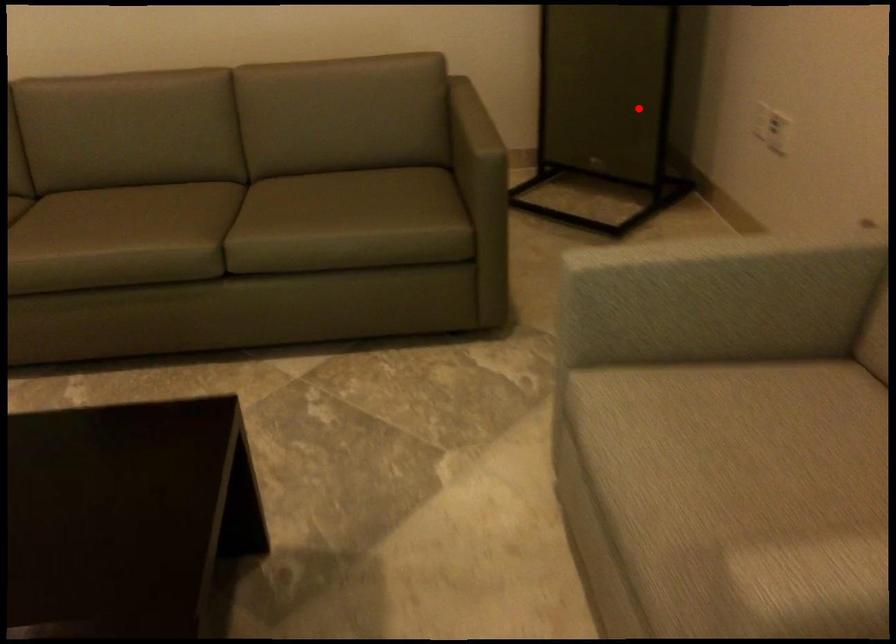
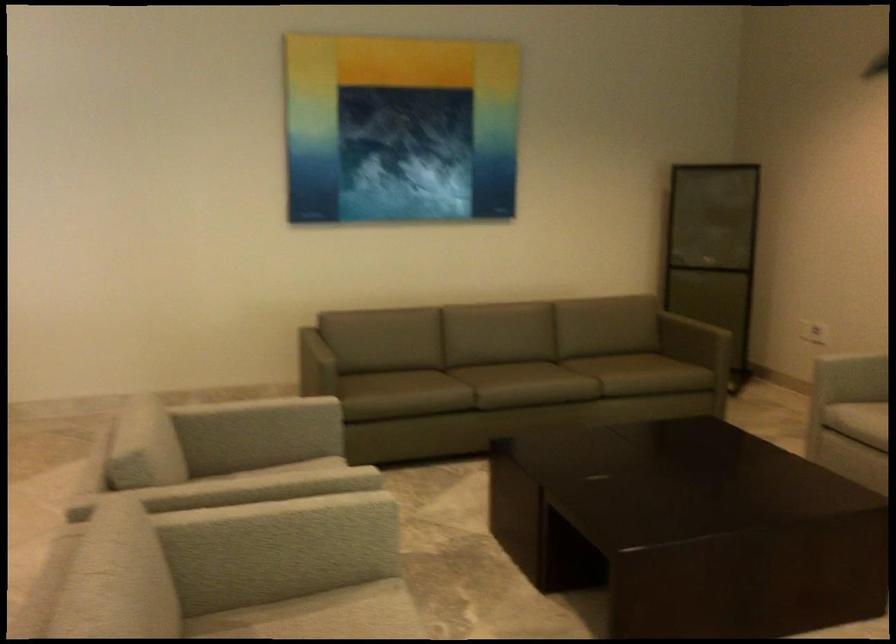
In the second image, find the point that corresponds to the highlighted location in the first image.

(713, 317)